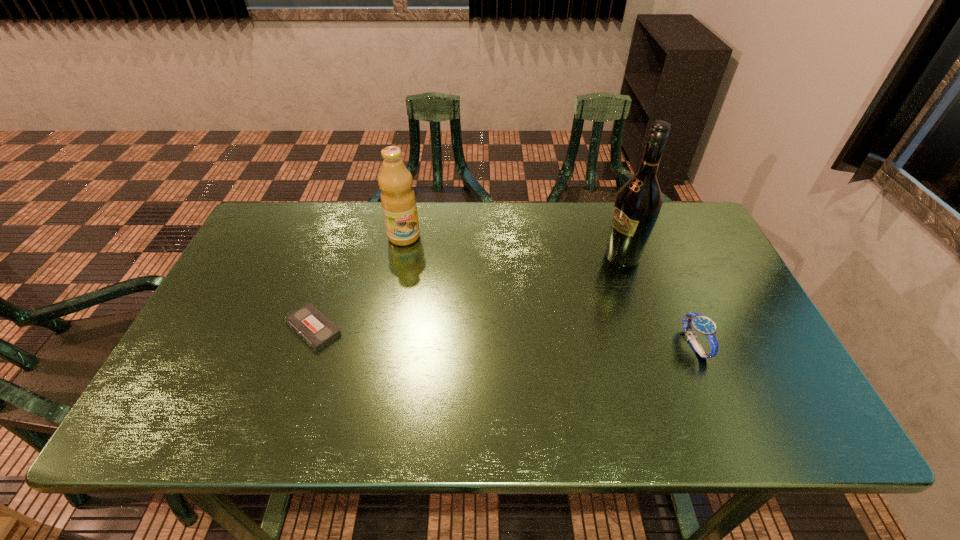
At what (x,y) coordinates should I click in order to perform the action: click on vacant space located 0.060m on the label of the wine bottle. Please return your answer as a coordinate pair (x, y). Looking at the image, I should click on (591, 271).

This screenshot has height=540, width=960. I want to click on free space located 0.160m on the label of the wine bottle, so click(x=563, y=284).

Identify the location of free space located 0.260m on the label of the wine bottle. (533, 297).

Locate an element on the screen. vacant space situated on the label of the olive oil is located at coordinates [x=441, y=324].

This screenshot has height=540, width=960. Find the location of `vacant space located on the label of the olive oil`. vacant space located on the label of the olive oil is located at coordinates (417, 268).

Image resolution: width=960 pixels, height=540 pixels. I want to click on blank area located on the label of the olive oil, so click(437, 315).

In order to click on wine bottle situated at the far edge in this screenshot , I will do `click(638, 202)`.

In order to click on olive oil situated at the far edge in this screenshot , I will do `click(395, 181)`.

Locate an element on the screen. This screenshot has height=540, width=960. object that is at the near edge is located at coordinates (704, 326).

In order to click on object that is at the right edge in this screenshot , I will do tap(704, 326).